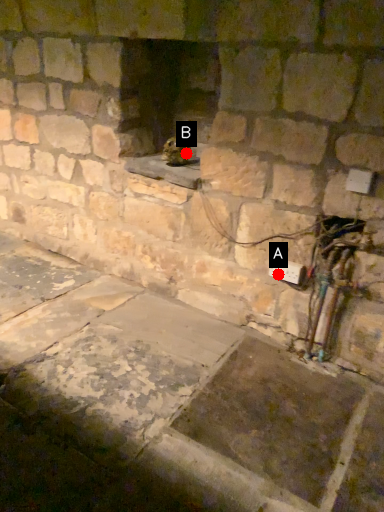
Question: Two points are circled on the image, labeled by A and B beside each circle. Which of the following is the closest to the observer?

Choices:
 (A) A is closer
 (B) B is closer

Answer: (A)